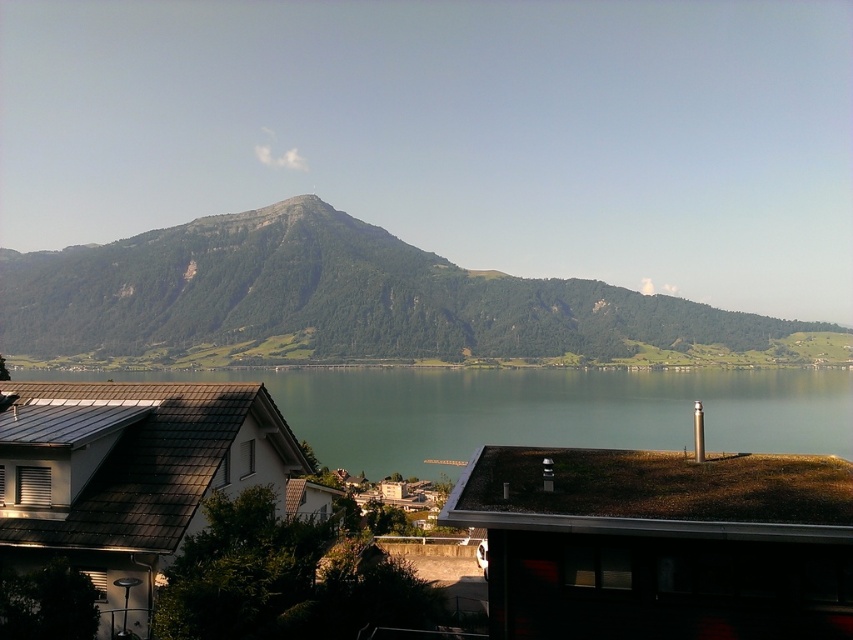
You are standing at the base of the green textured mountain at center and want to reach the summit. If you have a hiking pace of 2 miles per hour, how long would it take to reach the summit assuming the distance is 871.51 feet?

The distance to the summit is 871.51 feet. Converting feet to miles, 871.51 feet is approximately 0.165 miles. At a hiking pace of 2 miles per hour, the time required would be 0.165 miles divided by 2 mph, which equals approximately 0.0825 hours. Converting hours to minutes, this is roughly 5 minutes. Therefore, it would take about 5 minutes to reach the summit.

You are planning to build a hiking trail that starts from the base of the green textured mountain at center. Based on the mountain terrain described, what potential challenges might you anticipate?

The green textured mountain at center has steep and rugged slopes with variations in soil composition and weathering, which could pose challenges like unstable terrain, difficult ascent paths, and potential erosion issues during trail construction.